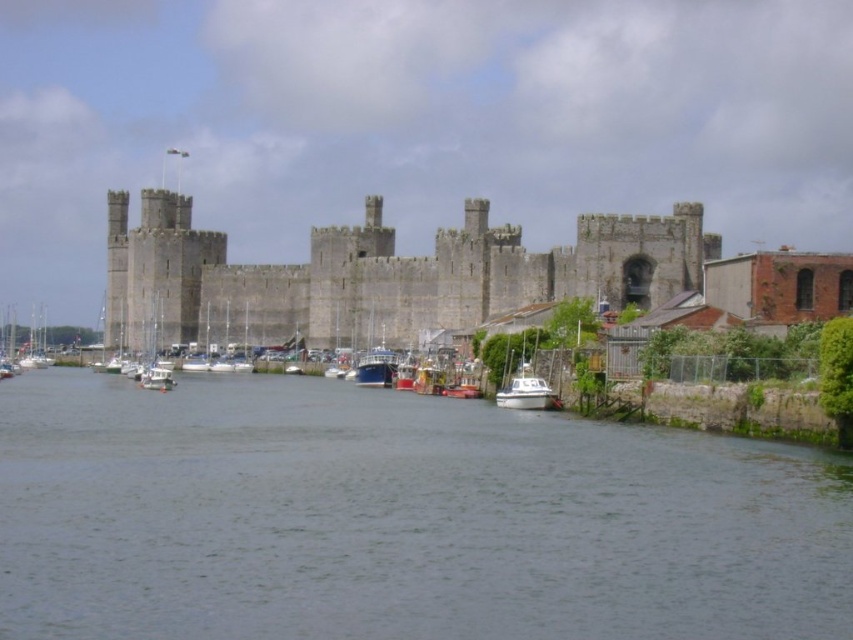
Is gray concrete water at lower center to the left of gray stone castle at center from the viewer's perspective?

No, gray concrete water at lower center is not to the left of gray stone castle at center.

The image size is (853, 640). Describe the element at coordinates (399, 518) in the screenshot. I see `gray concrete water at lower center` at that location.

Describe the element at coordinates (399, 518) in the screenshot. I see `gray concrete water at lower center` at that location.

Locate an element on the screen. gray concrete water at lower center is located at coordinates (399, 518).

Is gray concrete water at lower center positioned behind white glossy boat at lower right?

No, gray concrete water at lower center is closer to the viewer.

Who is more distant from viewer, [677,445] or [544,406]?

Positioned behind is point [544,406].

Find the location of a particular element. The width and height of the screenshot is (853, 640). gray concrete water at lower center is located at coordinates (399, 518).

Between white glossy boat at lower right and white matte sailboat at left, which one appears on the left side from the viewer's perspective?

Positioned to the left is white matte sailboat at left.

The width and height of the screenshot is (853, 640). I want to click on white glossy boat at lower right, so click(526, 392).

The image size is (853, 640). Identify the location of white glossy boat at lower right. (526, 392).